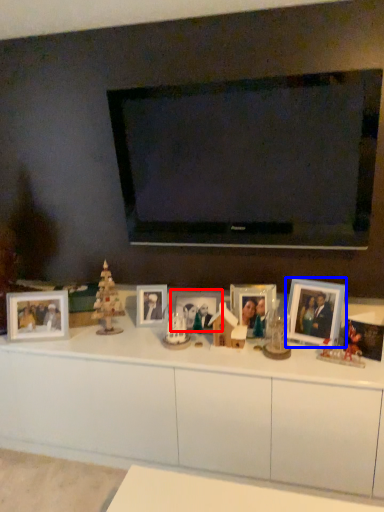
Question: Which point is closer to the camera, picture frame (highlighted by a red box) or picture frame (highlighted by a blue box)?

Choices:
 (A) picture frame
 (B) picture frame

Answer: (B)